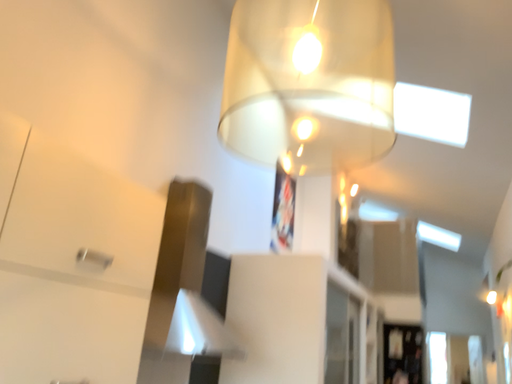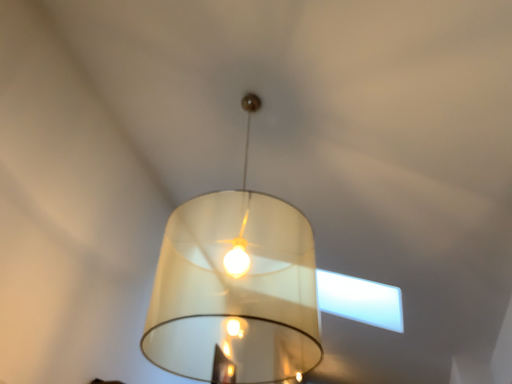
Question: Which way did the camera rotate in the video?

Choices:
 (A) rotated right
 (B) rotated left

Answer: (A)